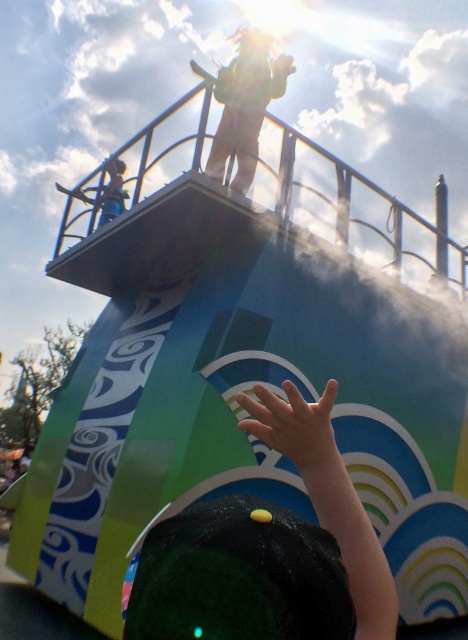
Who is more distant from viewer, (269, 97) or (111, 161)?

The point (111, 161) is behind.

Between green fabric shirt at upper center and metallic silver helmet at upper left, which one appears on the left side from the viewer's perspective?

From the viewer's perspective, metallic silver helmet at upper left appears more on the left side.

Describe the element at coordinates (246, 106) in the screenshot. I see `green fabric shirt at upper center` at that location.

Where is `green fabric shirt at upper center`? The image size is (468, 640). green fabric shirt at upper center is located at coordinates (246, 106).

Does point (241, 106) come behind point (268, 436)?

That is True.

Can you confirm if green fabric shirt at upper center is taller than light skin hand at center?

Correct, green fabric shirt at upper center is much taller as light skin hand at center.

Find the location of a particular element. Image resolution: width=468 pixels, height=640 pixels. green fabric shirt at upper center is located at coordinates (246, 106).

Is dark green fabric hand at lower center positioned in front of metallic silver helmet at upper left?

That is True.

Is dark green fabric hand at lower center smaller than metallic silver helmet at upper left?

No, dark green fabric hand at lower center is not smaller than metallic silver helmet at upper left.

What do you see at coordinates (270, 548) in the screenshot? This screenshot has width=468, height=640. I see `dark green fabric hand at lower center` at bounding box center [270, 548].

Where is `dark green fabric hand at lower center`? dark green fabric hand at lower center is located at coordinates (270, 548).